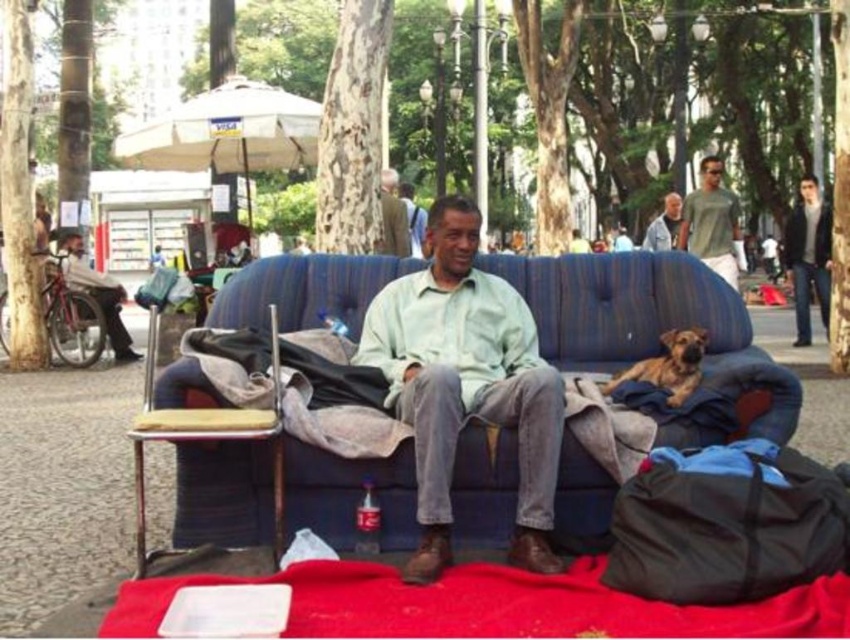
Question: Based on their relative distances, which object is nearer to the light brown leather jacket at upper center?

Choices:
 (A) blue fabric couch at center
 (B) light green cotton shirt at center
 (C) dark gray jacket at right

Answer: (B)

Question: Among these points, which one is nearest to the camera?

Choices:
 (A) (553, 582)
 (B) (389, 196)
 (C) (666, 237)
 (D) (800, 276)

Answer: (A)

Question: Is dark gray jacket at right to the left of smooth gray shirt at upper center from the viewer's perspective?

Choices:
 (A) no
 (B) yes

Answer: (A)

Question: Can you confirm if dark gray jacket at right is positioned to the left of light brown leather jacket at upper center?

Choices:
 (A) yes
 (B) no

Answer: (B)

Question: Is red fabric blanket at lower center closer to camera compared to light brown leather jacket at left?

Choices:
 (A) yes
 (B) no

Answer: (A)

Question: Among these objects, which one is nearest to the camera?

Choices:
 (A) matte green t-shirt at upper right
 (B) blue fabric couch at center

Answer: (B)